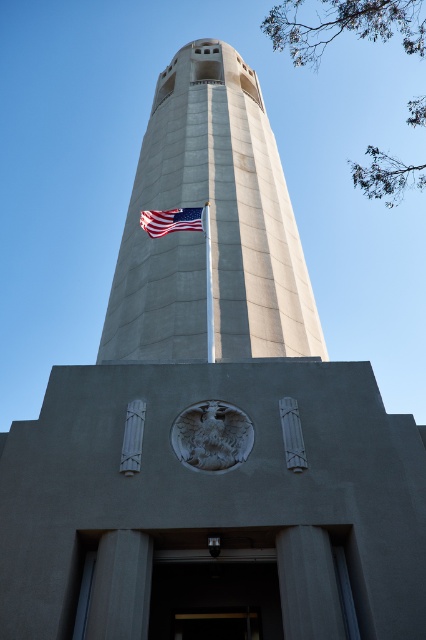
Question: Which of the following is the farthest from the observer?

Choices:
 (A) (227, 340)
 (B) (178, 212)

Answer: (B)

Question: Considering the relative positions of american flag at center and white smooth flag pole at center in the image provided, where is american flag at center located with respect to white smooth flag pole at center?

Choices:
 (A) below
 (B) above

Answer: (B)

Question: Can you confirm if american flag at center is positioned above white smooth flag pole at center?

Choices:
 (A) yes
 (B) no

Answer: (A)

Question: Is concrete tower at center above white smooth flag pole at center?

Choices:
 (A) yes
 (B) no

Answer: (A)

Question: Which point is closer to the camera?

Choices:
 (A) (195, 218)
 (B) (210, 328)
 (C) (264, 164)

Answer: (B)

Question: Which point is farther to the camera?

Choices:
 (A) white smooth flag pole at center
 (B) american flag at center

Answer: (B)